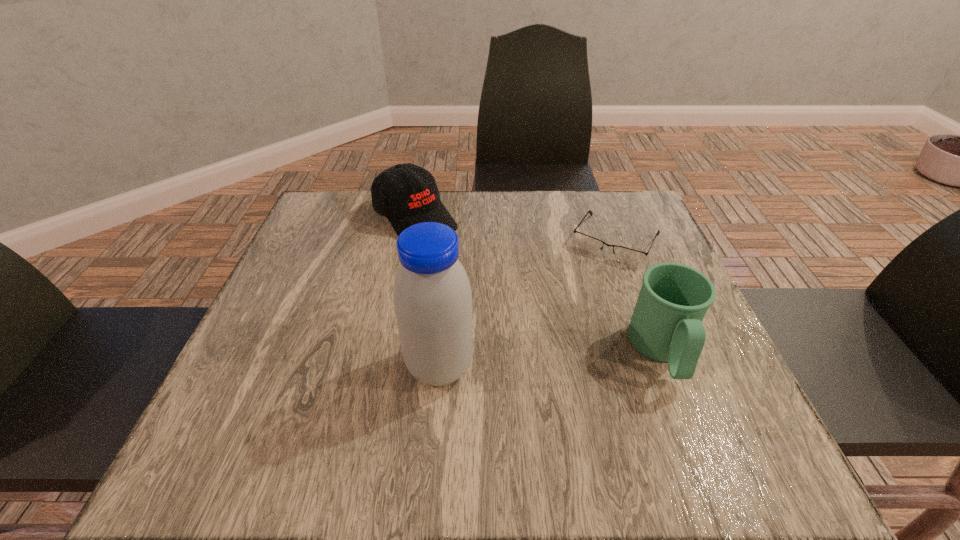
The image size is (960, 540). In order to click on free space between the tallest object and the mug in this screenshot , I will do `click(551, 359)`.

Where is `free space between the mug and the soya milk`? This screenshot has height=540, width=960. free space between the mug and the soya milk is located at coordinates (551, 359).

This screenshot has height=540, width=960. I want to click on free space between the baseball cap and the spectacles, so click(x=516, y=230).

Identify the location of object that is the nearest to the tallest object. Image resolution: width=960 pixels, height=540 pixels. (407, 194).

At what (x,y) coordinates should I click in order to perform the action: click on object that is the second nearest to the mug. Please return your answer as a coordinate pair (x, y). Looking at the image, I should click on (432, 296).